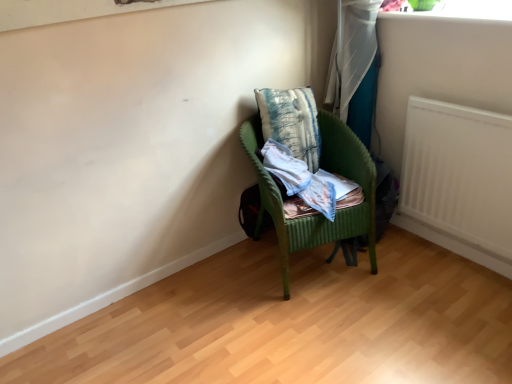
Find the location of a particular element. The height and width of the screenshot is (384, 512). textured blue pillow at center is located at coordinates (291, 122).

Measure the distance between white fabric curtain at upper right and camera.

white fabric curtain at upper right is 1.93 meters from camera.

Image resolution: width=512 pixels, height=384 pixels. Describe the element at coordinates (458, 181) in the screenshot. I see `white matte radiator at right` at that location.

The height and width of the screenshot is (384, 512). I want to click on textured blue pillow at center, so click(x=291, y=122).

Can you confirm if green wicker chair at center is positioned to the left of textured blue pillow at center?

No.

Would you say green wicker chair at center is a long distance from textured blue pillow at center?

No, green wicker chair at center is not far from textured blue pillow at center.

In terms of height, does green wicker chair at center look taller or shorter compared to textured blue pillow at center?

Considering their sizes, green wicker chair at center has more height than textured blue pillow at center.

How many degrees apart are the facing directions of light blue cotton shirt at center and green wicker chair at center?

There is a 4.88-degree angle between the facing directions of light blue cotton shirt at center and green wicker chair at center.

Which is farther, [320,176] or [368,204]?

Positioned behind is point [320,176].

Is light blue cotton shirt at center not close to green wicker chair at center?

No, light blue cotton shirt at center is in close proximity to green wicker chair at center.

Is light blue cotton shirt at center shorter than white fabric curtain at upper right?

Indeed, light blue cotton shirt at center has a lesser height compared to white fabric curtain at upper right.

Considering the sizes of objects light blue cotton shirt at center and white fabric curtain at upper right in the image provided, who is smaller, light blue cotton shirt at center or white fabric curtain at upper right?

light blue cotton shirt at center.

Between light blue cotton shirt at center and white fabric curtain at upper right, which one has larger width?

With larger width is light blue cotton shirt at center.

Based on their positions, is light blue cotton shirt at center located to the left or right of white fabric curtain at upper right?

Based on their positions, light blue cotton shirt at center is located to the left of white fabric curtain at upper right.

Is point (490, 255) in front of point (342, 114)?

Yes, point (490, 255) is in front of point (342, 114).

Locate an element on the screen. The image size is (512, 384). curtain that appears behind the white matte radiator at right is located at coordinates (355, 66).

Considering the relative positions of white matte radiator at right and white fabric curtain at upper right in the image provided, is white matte radiator at right behind white fabric curtain at upper right?

No, it is in front of white fabric curtain at upper right.

Is white matte radiator at right to the right of white fabric curtain at upper right from the viewer's perspective?

Indeed, white matte radiator at right is positioned on the right side of white fabric curtain at upper right.

Which is in front, textured blue pillow at center or light blue cotton shirt at center?

Positioned in front is light blue cotton shirt at center.

Which object is positioned more to the right, textured blue pillow at center or light blue cotton shirt at center?

Positioned to the right is light blue cotton shirt at center.

Which of these two, textured blue pillow at center or light blue cotton shirt at center, stands taller?

With more height is textured blue pillow at center.

In terms of width, does textured blue pillow at center look wider or thinner when compared to light blue cotton shirt at center?

Clearly, textured blue pillow at center has less width compared to light blue cotton shirt at center.

Based on their sizes in the image, would you say white fabric curtain at upper right is bigger or smaller than textured blue pillow at center?

Considering their sizes, white fabric curtain at upper right takes up more space than textured blue pillow at center.

Between white fabric curtain at upper right and textured blue pillow at center, which one appears on the left side from the viewer's perspective?

From the viewer's perspective, textured blue pillow at center appears more on the left side.

Is green wicker chair at center wider than white fabric curtain at upper right?

Correct, the width of green wicker chair at center exceeds that of white fabric curtain at upper right.

Considering the relative sizes of green wicker chair at center and white fabric curtain at upper right in the image provided, is green wicker chair at center smaller than white fabric curtain at upper right?

No.

From the image's perspective, is green wicker chair at center above white fabric curtain at upper right?

No, from the image's perspective, green wicker chair at center is not on top of white fabric curtain at upper right.

Visually, is green wicker chair at center positioned to the left or to the right of white fabric curtain at upper right?

Clearly, green wicker chair at center is on the left of white fabric curtain at upper right in the image.

This screenshot has width=512, height=384. Find the location of `pillow that is on the left side of green wicker chair at center`. pillow that is on the left side of green wicker chair at center is located at coordinates (291, 122).

At what (x,y) coordinates should I click in order to perform the action: click on chair that is under the light blue cotton shirt at center (from a real-world perspective). Please return your answer as a coordinate pair (x, y). Looking at the image, I should click on (327, 171).

Looking at the image, which one is located further to green wicker chair at center, white fabric curtain at upper right or textured blue pillow at center?

Based on the image, white fabric curtain at upper right appears to be further to green wicker chair at center.

Which object lies nearer to the anchor point textured blue pillow at center, white fabric curtain at upper right or white matte radiator at right?

Based on the image, white fabric curtain at upper right appears to be nearer to textured blue pillow at center.

Looking at the image, which one is located closer to green wicker chair at center, white fabric curtain at upper right or white matte radiator at right?

The object closer to green wicker chair at center is white fabric curtain at upper right.

Estimate the real-world distances between objects in this image. Which object is further from white fabric curtain at upper right, white matte radiator at right or textured blue pillow at center?

white matte radiator at right is further to white fabric curtain at upper right.

Estimate the real-world distances between objects in this image. Which object is further from white matte radiator at right, light blue cotton shirt at center or textured blue pillow at center?

Based on the image, textured blue pillow at center appears to be further to white matte radiator at right.

Considering their positions, is light blue cotton shirt at center positioned closer to white fabric curtain at upper right than green wicker chair at center?

Based on the image, green wicker chair at center appears to be nearer to white fabric curtain at upper right.

From the image, which object appears to be farther from textured blue pillow at center, white fabric curtain at upper right or light blue cotton shirt at center?

white fabric curtain at upper right lies further to textured blue pillow at center than the other object.

Based on the photo, from the image, which object appears to be nearer to green wicker chair at center, textured blue pillow at center or white fabric curtain at upper right?

Among the two, textured blue pillow at center is located nearer to green wicker chair at center.

Find the location of a particular element. Image resolution: width=512 pixels, height=384 pixels. chair situated between textured blue pillow at center and white matte radiator at right from left to right is located at coordinates (327, 171).

The width and height of the screenshot is (512, 384). In order to click on clothing between white fabric curtain at upper right and green wicker chair at center in the up-down direction in this screenshot , I will do `click(308, 181)`.

This screenshot has height=384, width=512. Identify the location of clothing between textured blue pillow at center and green wicker chair at center in the vertical direction. (308, 181).

The image size is (512, 384). I want to click on pillow between white fabric curtain at upper right and green wicker chair at center vertically, so click(291, 122).